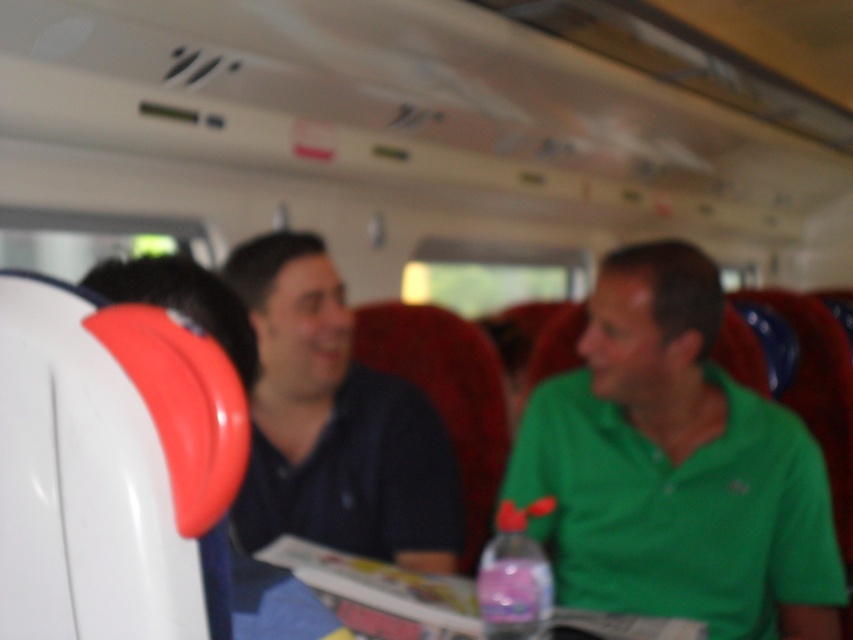
Question: Is green matte shirt at center below dark blue shirt at center?

Choices:
 (A) no
 (B) yes

Answer: (B)

Question: Which of the following is the farthest from the observer?

Choices:
 (A) dark blue shirt at center
 (B) green matte shirt at center

Answer: (A)

Question: Does green matte shirt at center have a lesser width compared to dark blue shirt at center?

Choices:
 (A) yes
 (B) no

Answer: (B)

Question: Is green matte shirt at center positioned in front of dark blue shirt at center?

Choices:
 (A) yes
 (B) no

Answer: (A)